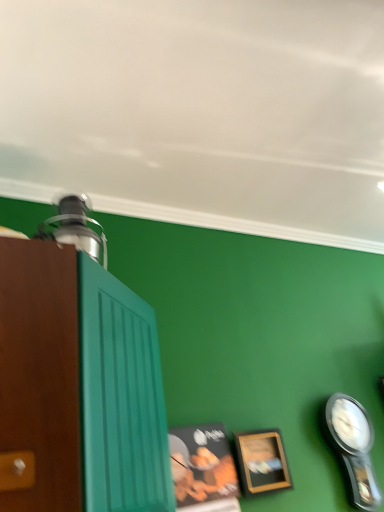
Question: Is wooden picture frame at lower right, the first picture frame in the right-to-left sequence, aimed at black plastic clock at lower right?

Choices:
 (A) no
 (B) yes

Answer: (A)

Question: Considering the relative sizes of wooden picture frame at lower right, the first picture frame in the right-to-left sequence, and black plastic clock at lower right in the image provided, is wooden picture frame at lower right, the first picture frame in the right-to-left sequence, smaller than black plastic clock at lower right?

Choices:
 (A) yes
 (B) no

Answer: (A)

Question: Is black plastic clock at lower right completely or partially inside wooden picture frame at lower right, positioned as the second picture frame in left-to-right order?

Choices:
 (A) yes
 (B) no

Answer: (B)

Question: Is wooden picture frame at lower right, positioned as the second picture frame in left-to-right order, facing away from black plastic clock at lower right?

Choices:
 (A) no
 (B) yes

Answer: (A)

Question: From the image's perspective, is wooden picture frame at lower right, the first picture frame in the right-to-left sequence, beneath black plastic clock at lower right?

Choices:
 (A) no
 (B) yes

Answer: (A)

Question: Is wooden picture frame at lower right, the first picture frame in the right-to-left sequence, next to black plastic clock at lower right?

Choices:
 (A) yes
 (B) no

Answer: (B)

Question: Can you confirm if wooden picture frame at lower right, the first picture frame in the right-to-left sequence, is positioned to the left of brown wood cabinet at left?

Choices:
 (A) no
 (B) yes

Answer: (A)

Question: Is wooden picture frame at lower right, the first picture frame in the right-to-left sequence, smaller than brown wood cabinet at left?

Choices:
 (A) yes
 (B) no

Answer: (A)

Question: Considering the relative sizes of wooden picture frame at lower right, positioned as the second picture frame in left-to-right order, and brown wood cabinet at left in the image provided, is wooden picture frame at lower right, positioned as the second picture frame in left-to-right order, bigger than brown wood cabinet at left?

Choices:
 (A) yes
 (B) no

Answer: (B)

Question: Considering the relative positions of wooden picture frame at lower right, the first picture frame in the right-to-left sequence, and brown wood cabinet at left in the image provided, is wooden picture frame at lower right, the first picture frame in the right-to-left sequence, in front of brown wood cabinet at left?

Choices:
 (A) no
 (B) yes

Answer: (A)

Question: Is wooden picture frame at lower right, positioned as the second picture frame in left-to-right order, surrounding brown wood cabinet at left?

Choices:
 (A) yes
 (B) no

Answer: (B)

Question: Is wooden picture frame at lower right, the first picture frame in the right-to-left sequence, positioned with its back to brown wood cabinet at left?

Choices:
 (A) no
 (B) yes

Answer: (A)

Question: Considering the relative sizes of wooden picture frame at lower center, the first picture frame in the left-to-right sequence, and black plastic clock at lower right in the image provided, is wooden picture frame at lower center, the first picture frame in the left-to-right sequence, bigger than black plastic clock at lower right?

Choices:
 (A) yes
 (B) no

Answer: (B)